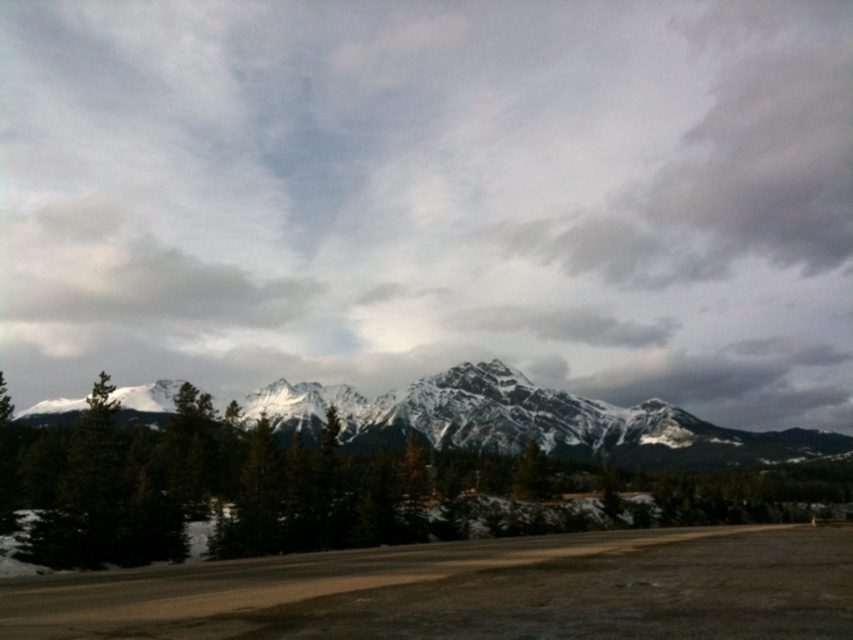
Question: Is cloudy sky at upper center further to camera compared to snowy granite mountains at center?

Choices:
 (A) no
 (B) yes

Answer: (B)

Question: Is snowy granite mountains at center to the left of green matte tree at left from the viewer's perspective?

Choices:
 (A) no
 (B) yes

Answer: (A)

Question: Based on their relative distances, which object is nearer to the green matte tree at left?

Choices:
 (A) snowy granite mountains at center
 (B) cloudy sky at upper center

Answer: (A)

Question: Which of the following is the closest to the observer?

Choices:
 (A) cloudy sky at upper center
 (B) snowy granite mountains at center
 (C) green matte tree at left

Answer: (C)

Question: Can you confirm if cloudy sky at upper center is bigger than snowy granite mountains at center?

Choices:
 (A) yes
 (B) no

Answer: (A)

Question: Which of these objects is positioned closest to the cloudy sky at upper center?

Choices:
 (A) snowy granite mountains at center
 (B) green matte tree at left

Answer: (A)